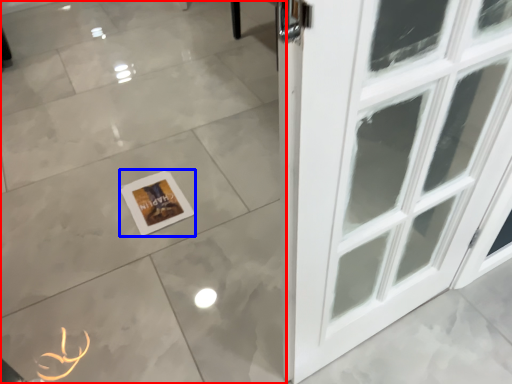
Question: Which object appears farthest to the camera in this image, ceramic tile (highlighted by a red box) or picture frame (highlighted by a blue box)?

Choices:
 (A) ceramic tile
 (B) picture frame

Answer: (B)